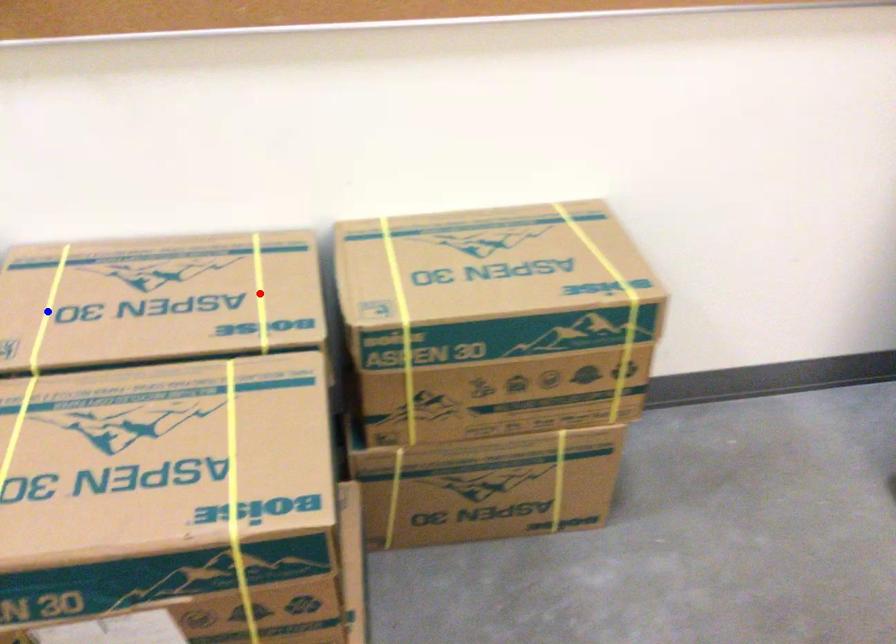
Question: In the image, two points are highlighted. Which point is nearer to the camera? Reply with the corresponding letter.

Choices:
 (A) blue point
 (B) red point

Answer: (A)